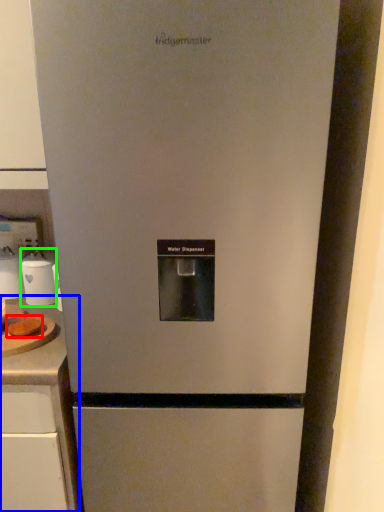
Question: Estimate the real-world distances between objects in this image. Which object is closer to food (highlighted by a red box), counter top (highlighted by a blue box) or appliance (highlighted by a green box)?

Choices:
 (A) counter top
 (B) appliance

Answer: (B)